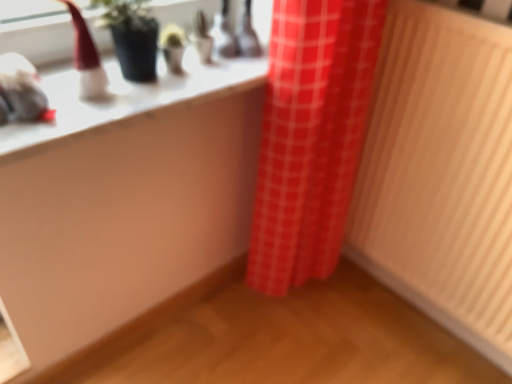
Find the location of a particular element. This screenshot has width=512, height=384. free space between red checkered curtain at center and wooden radiator at right is located at coordinates pos(377,338).